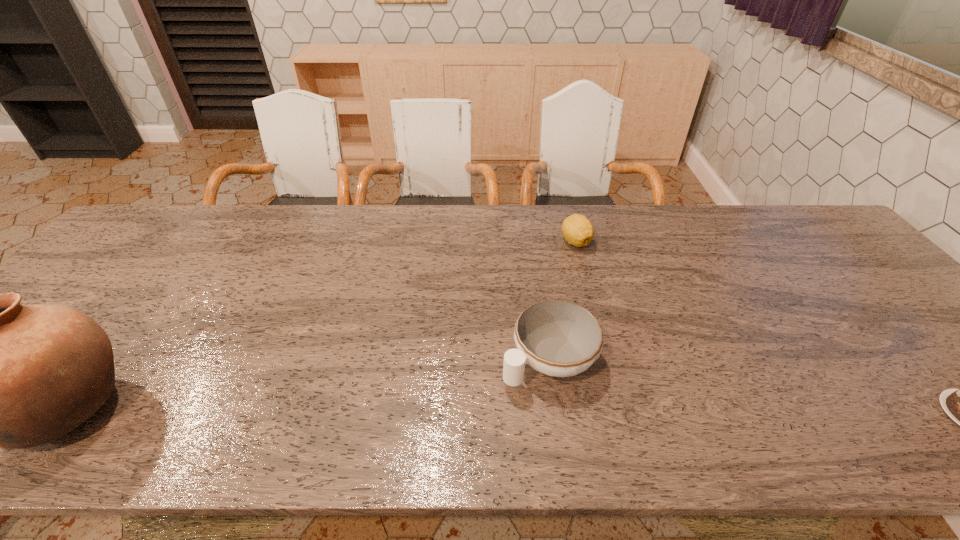
Locate an element on the screen. vacant region at the near edge of the desktop is located at coordinates (281, 399).

Where is `vacant region at the right edge of the desktop`? vacant region at the right edge of the desktop is located at coordinates (878, 336).

The height and width of the screenshot is (540, 960). Identify the location of the second closest object to the tallest object. [x=577, y=229].

Locate which object is the third closest to the third shortest object. Please provide its 2D coordinates. Your answer should be formatted as a tuple, i.e. [(x, y)], where the tuple contains the x and y coordinates of a point satisfying the conditions above.

[(0, 375)]

Where is `vacant region that satisfies the following two spatial constraints: 1. on the back side of the second tallest object; 2. on the right side of the lemon`? vacant region that satisfies the following two spatial constraints: 1. on the back side of the second tallest object; 2. on the right side of the lemon is located at coordinates (532, 241).